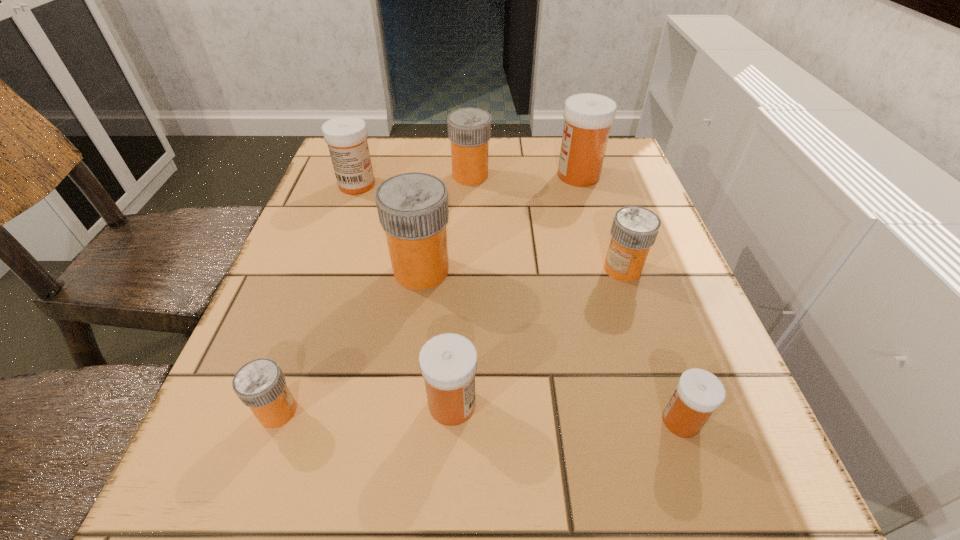
Find the location of a particular element. Image resolution: width=960 pixels, height=540 pixels. object situated at the far right corner is located at coordinates (588, 117).

This screenshot has height=540, width=960. I want to click on free space at the far edge of the desktop, so click(x=546, y=175).

Locate an element on the screen. The image size is (960, 540). vacant space at the near edge is located at coordinates (458, 528).

You are a GUI agent. You are given a task and a screenshot of the screen. Output one action in this format:
    pyautogui.click(x=<x>, y=<y>)
    Task: Click on the free space at the left edge of the desktop
    This screenshot has width=960, height=540.
    Given the screenshot: What is the action you would take?
    pyautogui.click(x=304, y=231)

I want to click on vacant point at the right edge, so click(644, 199).

In the image, there is a desktop. What are the coordinates of `vacant space at the far left corner` in the screenshot? It's located at (395, 157).

This screenshot has width=960, height=540. In the image, there is a desktop. Identify the location of vacant space at the near left corner. (217, 483).

Find the location of a particular element. This screenshot has height=540, width=960. vacant area at the near right corner of the desktop is located at coordinates (757, 534).

Where is `empty location between the third biggest orange medicine and the farthest orange medicine`? Image resolution: width=960 pixels, height=540 pixels. empty location between the third biggest orange medicine and the farthest orange medicine is located at coordinates (546, 222).

Identify the location of vacant space that is in between the second white medicine from left to right and the smallest orange medicine. This screenshot has height=540, width=960. (365, 408).